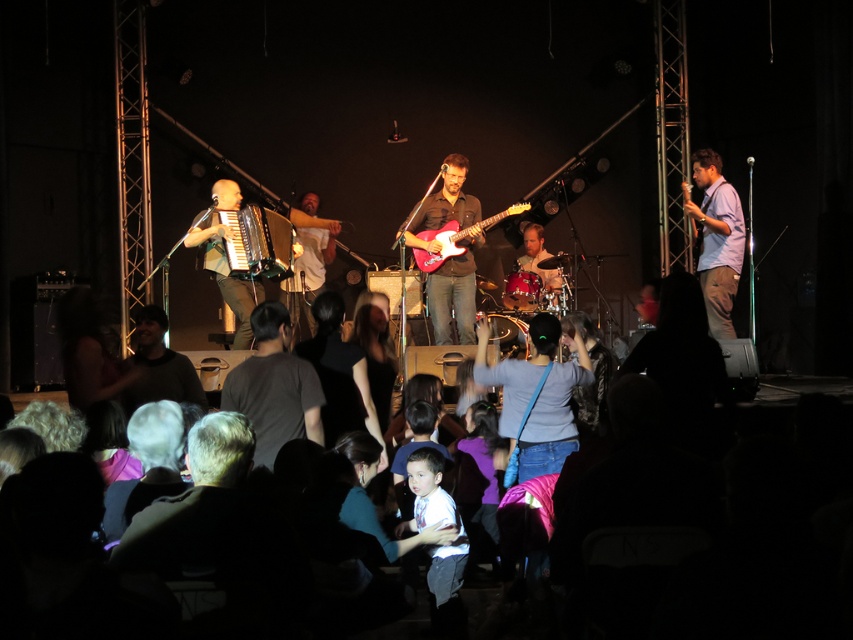
In the scene shown: You are at the point marked as point (717,240) on the stage. What is the nearest object to you?

The nearest object to you is the light blue shirt at right, as it is located exactly at the point (717,240).